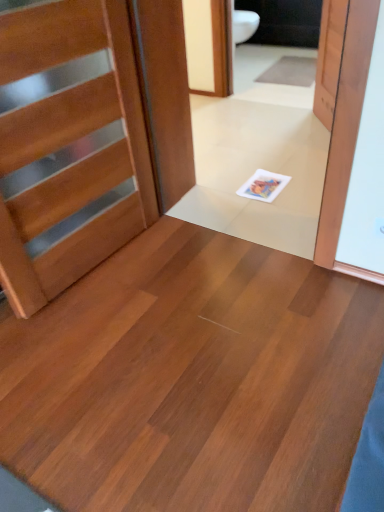
Find the location of `free location above matte wood floor at center (from a real-world perspective)`. free location above matte wood floor at center (from a real-world perspective) is located at coordinates [x=178, y=342].